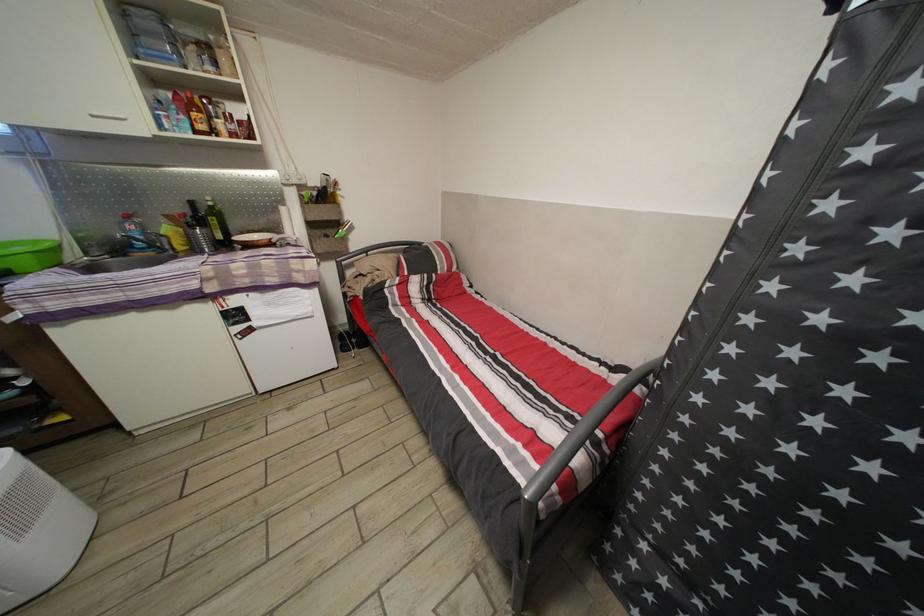
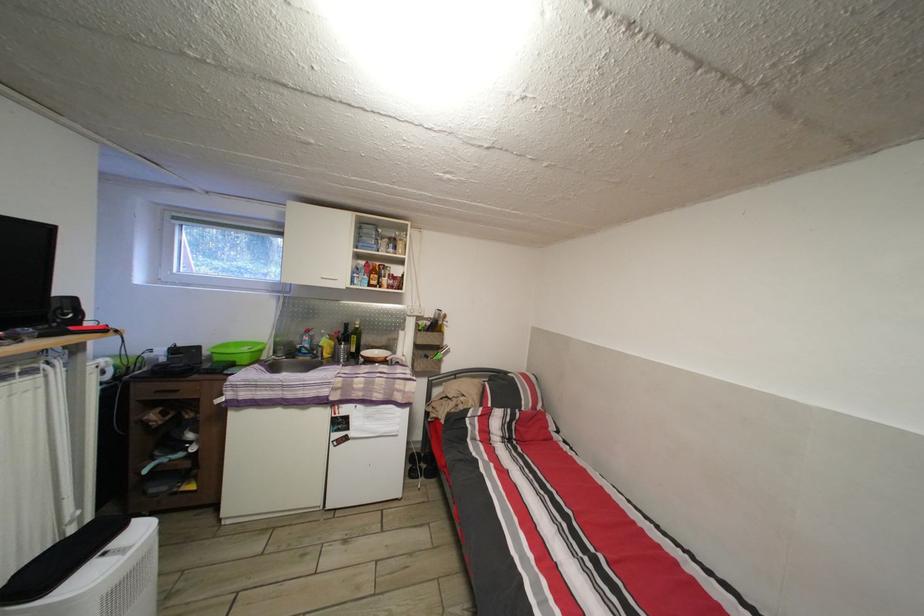
Locate, in the second image, the point that corresponds to the point at 220,227 in the first image.

(360, 345)